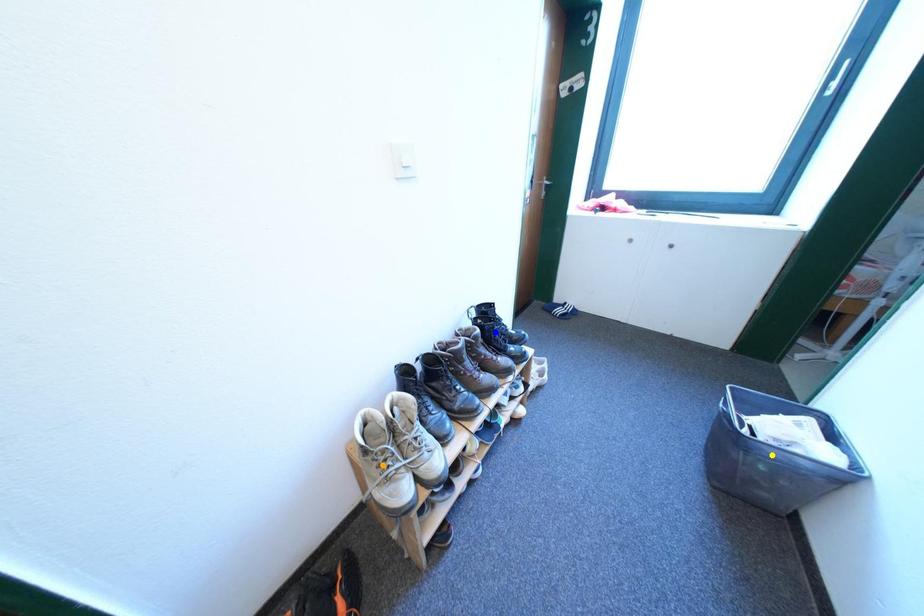
Order these from nearest to farthest:
A) orange point
B) blue point
C) yellow point

1. orange point
2. yellow point
3. blue point